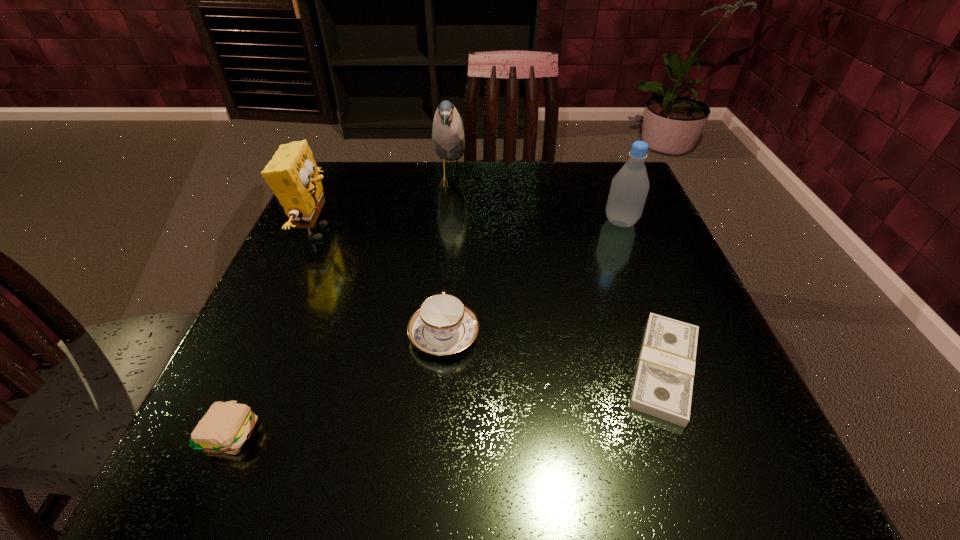
Identify the location of the farthest object. The width and height of the screenshot is (960, 540). (448, 138).

Locate an element on the screen. bottle is located at coordinates (629, 188).

At what (x,y) coordinates should I click in order to perform the action: click on sponge. Please return your answer as a coordinate pair (x, y). The width and height of the screenshot is (960, 540). Looking at the image, I should click on (292, 174).

You are a GUI agent. You are given a task and a screenshot of the screen. Output one action in this format:
    pyautogui.click(x=<x>, y=<y>)
    Task: Click on the third shortest object
    
    Given the screenshot: What is the action you would take?
    pyautogui.click(x=443, y=325)

This screenshot has width=960, height=540. Identify the location of the second shortest object. (226, 426).

Locate an element on the screen. The height and width of the screenshot is (540, 960). the shortest object is located at coordinates (663, 385).

Locate an element on the screen. Image resolution: width=960 pixels, height=540 pixels. free space located at the tip of the farthest object's beak is located at coordinates (486, 181).

Locate an element on the screen. Image resolution: width=960 pixels, height=540 pixels. vacant space located 0.150m on the front of the bottle is located at coordinates (644, 281).

I want to click on vacant region located on the face of the sponge, so click(x=525, y=232).

Identify the location of vacant region located 0.160m on the side with the handle of the teacup. The width and height of the screenshot is (960, 540). (450, 251).